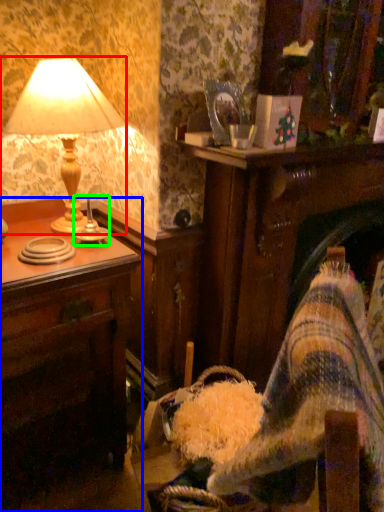
Question: Based on their relative distances, which object is nearer to lamp (highlighted by a red box)? Choose from desk (highlighted by a blue box) and candle holder (highlighted by a green box).

Choices:
 (A) desk
 (B) candle holder

Answer: (B)